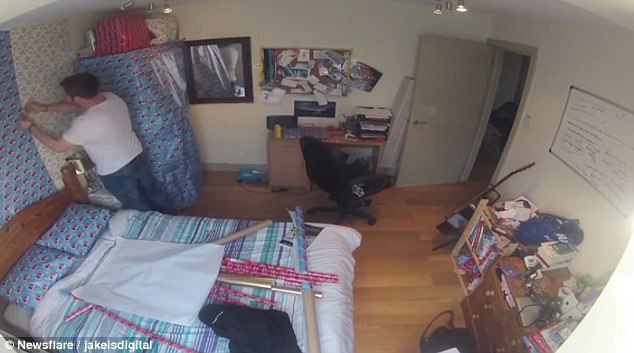
Where is `wooden floorboard`? The width and height of the screenshot is (634, 353). wooden floorboard is located at coordinates (404, 224).